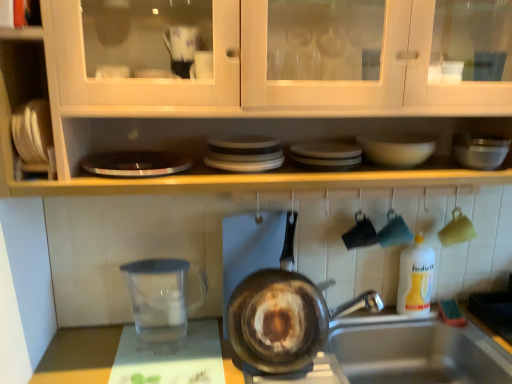
Question: From a real-world perspective, is transparent glass water at lower left over transparent plastic measuring cup at lower left?

Choices:
 (A) no
 (B) yes

Answer: (A)

Question: Is transparent glass water at lower left taller than transparent plastic measuring cup at lower left?

Choices:
 (A) no
 (B) yes

Answer: (A)

Question: Is transparent glass water at lower left behind transparent plastic measuring cup at lower left?

Choices:
 (A) yes
 (B) no

Answer: (B)

Question: From the image's perspective, is transparent glass water at lower left on top of transparent plastic measuring cup at lower left?

Choices:
 (A) no
 (B) yes

Answer: (A)

Question: Does transparent glass water at lower left appear on the right side of transparent plastic measuring cup at lower left?

Choices:
 (A) yes
 (B) no

Answer: (A)

Question: Is transparent glass water at lower left touching transparent plastic measuring cup at lower left?

Choices:
 (A) no
 (B) yes

Answer: (A)

Question: From the image's perspective, is metallic silver mixing bowl at upper right above silver metallic sink at lower right?

Choices:
 (A) yes
 (B) no

Answer: (A)

Question: Considering the relative positions of metallic silver mixing bowl at upper right and silver metallic sink at lower right in the image provided, is metallic silver mixing bowl at upper right to the left of silver metallic sink at lower right from the viewer's perspective?

Choices:
 (A) yes
 (B) no

Answer: (B)

Question: Is metallic silver mixing bowl at upper right shorter than silver metallic sink at lower right?

Choices:
 (A) no
 (B) yes

Answer: (B)

Question: From the image's perspective, is metallic silver mixing bowl at upper right located beneath silver metallic sink at lower right?

Choices:
 (A) no
 (B) yes

Answer: (A)

Question: Is metallic silver mixing bowl at upper right positioned before silver metallic sink at lower right?

Choices:
 (A) no
 (B) yes

Answer: (A)

Question: Considering the relative positions of metallic silver mixing bowl at upper right and silver metallic sink at lower right in the image provided, is metallic silver mixing bowl at upper right to the right of silver metallic sink at lower right from the viewer's perspective?

Choices:
 (A) no
 (B) yes

Answer: (B)

Question: Is white plastic bottle at right at the right side of white glossy bowl at upper center?

Choices:
 (A) yes
 (B) no

Answer: (A)